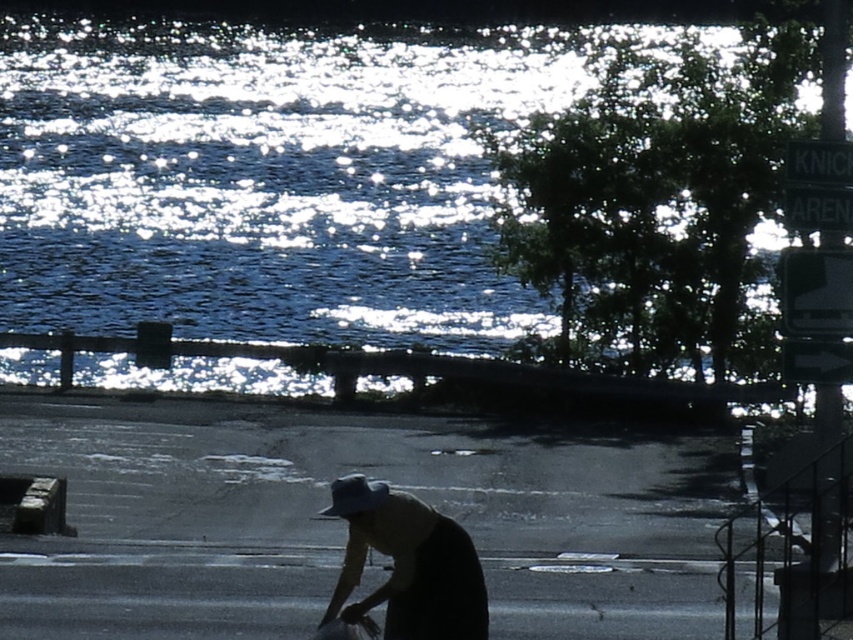
You are a tourist trying to read both signs at the waterfront. The metallic reflective sign at upper right and the black plastic sign at upper right are both in your view. Which one do you think is easier to read under the current lighting conditions?

The metallic reflective sign at upper right is larger than the black plastic sign at upper right, making it easier to read from a distance.

You are standing at the waterfront and want to take a photo of both the sparkling blue water at upper center and the metallic reflective sign at upper right. Which object should you focus on first if you want both to be in the same frame?

You should focus on the sparkling blue water at upper center first because it is much taller than the metallic reflective sign at upper right, so it will occupy more space in the frame and ensure both are visible.

Based on the scene description, where exactly is the black plastic sign at upper right located in terms of coordinates?

The black plastic sign at upper right is located at coordinates point (819, 161).